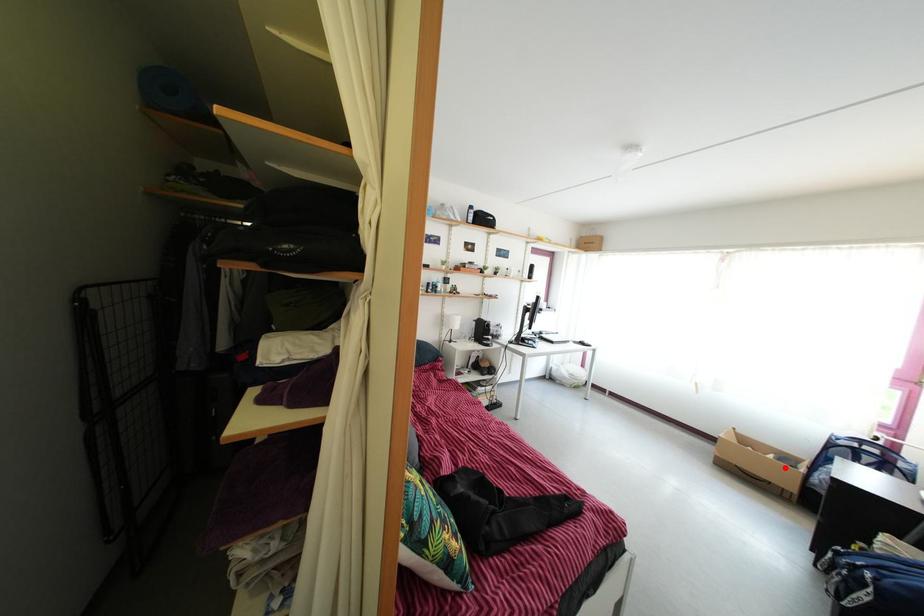
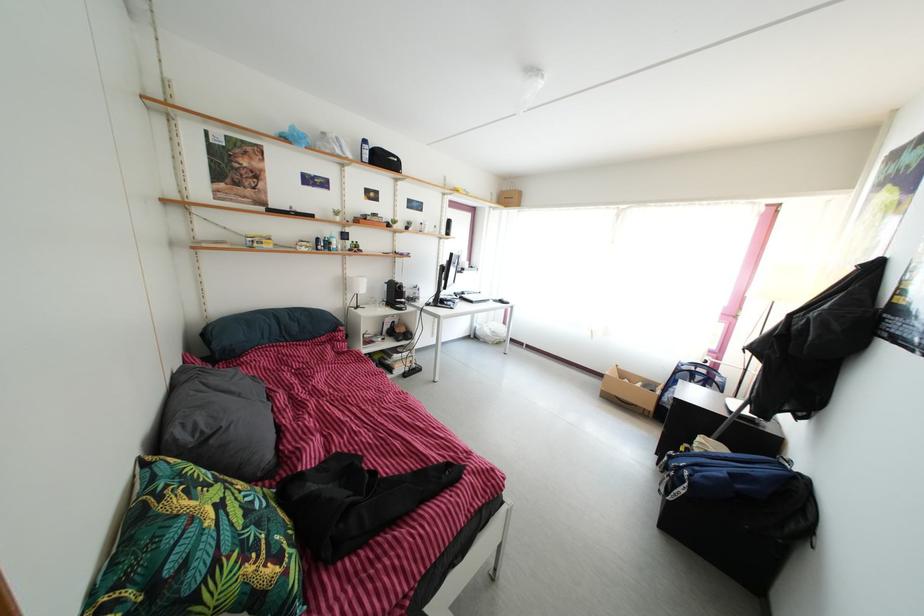
Locate, in the second image, the point that corresponds to the highlighted location in the first image.

(650, 394)